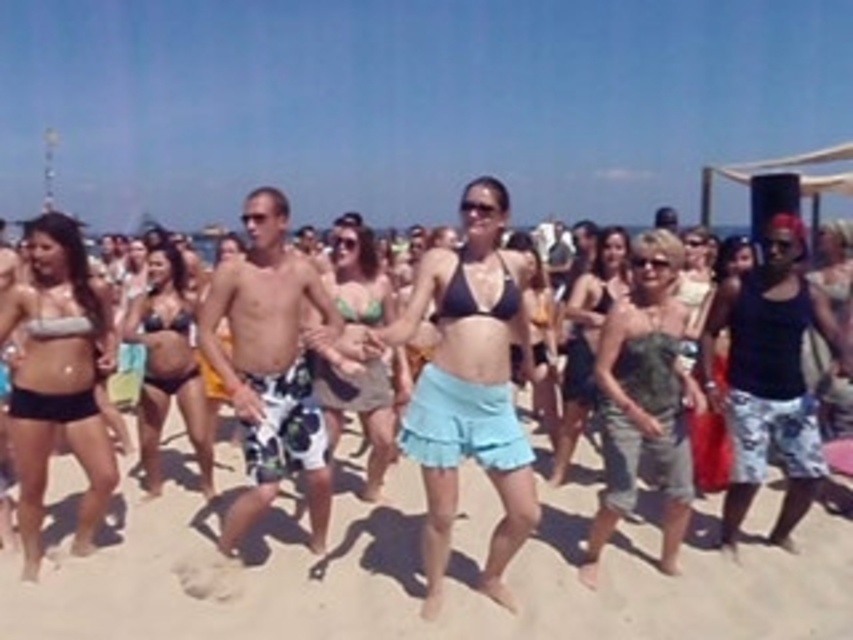
Who is positioned more to the left, matte black bikini at center or matte black bikini top at center?

matte black bikini at center

Who is shorter, matte black bikini at center or matte black bikini top at center?

Standing shorter between the two is matte black bikini top at center.

Which is in front, point (167, 406) or point (599, 273)?

Point (167, 406)

You are a GUI agent. You are given a task and a screenshot of the screen. Output one action in this format:
    pyautogui.click(x=<x>, y=<y>)
    Task: Click on the matte black bikini at center
    The image size is (853, 640).
    Given the screenshot: What is the action you would take?
    pyautogui.click(x=167, y=365)

Does printed swim trunks at center have a smaller size compared to green bikini top at center?

Yes, printed swim trunks at center is smaller than green bikini top at center.

Does printed swim trunks at center appear under green bikini top at center?

No, printed swim trunks at center is not below green bikini top at center.

Between point (250, 243) and point (381, 372), which one is positioned behind?

The point (381, 372) is more distant.

Where is `printed swim trunks at center`? printed swim trunks at center is located at coordinates (271, 365).

Can you confirm if printed swim trunks at center is smaller than matte black bikini top at center?

No.

Looking at this image, who is more forward, (262, 499) or (612, 236)?

Positioned in front is point (262, 499).

The width and height of the screenshot is (853, 640). I want to click on printed swim trunks at center, so click(x=271, y=365).